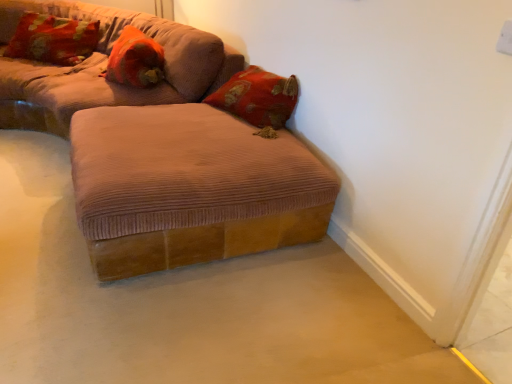
Measure the distance between corduroy brown ottoman at center, which is counted as the second studio couch, starting from the bottom, and camera.

corduroy brown ottoman at center, which is counted as the second studio couch, starting from the bottom, is 2.44 meters away from camera.

Image resolution: width=512 pixels, height=384 pixels. What do you see at coordinates (104, 66) in the screenshot?
I see `corduroy brown ottoman at center, which is counted as the second studio couch, starting from the bottom` at bounding box center [104, 66].

The width and height of the screenshot is (512, 384). What do you see at coordinates (53, 39) in the screenshot? I see `velvet floral pillow at upper left, which is the 1th pillow in left-to-right order` at bounding box center [53, 39].

How much space does orange corduroy pillow at upper left, arranged as the second pillow when viewed from the left, occupy vertically?

orange corduroy pillow at upper left, arranged as the second pillow when viewed from the left, is 31.19 centimeters in height.

Locate an element on the screen. corduroy brown ottoman at lower center, which is the first studio couch in bottom-to-top order is located at coordinates (164, 152).

How different are the orientations of corduroy brown ottoman at center, which is counted as the second studio couch, starting from the bottom, and corduroy brown ottoman at lower center, which is the first studio couch in bottom-to-top order, in degrees?

The angular difference between corduroy brown ottoman at center, which is counted as the second studio couch, starting from the bottom, and corduroy brown ottoman at lower center, which is the first studio couch in bottom-to-top order, is 93.6 degrees.

Is corduroy brown ottoman at center, marked as the 1th studio couch in a top-to-bottom arrangement, inside the boundaries of corduroy brown ottoman at lower center, positioned as the second studio couch in top-to-bottom order, or outside?

corduroy brown ottoman at center, marked as the 1th studio couch in a top-to-bottom arrangement, is not enclosed by corduroy brown ottoman at lower center, positioned as the second studio couch in top-to-bottom order.

I want to click on studio couch on the right of corduroy brown ottoman at center, marked as the 1th studio couch in a top-to-bottom arrangement, so click(164, 152).

Which object is positioned more to the right, corduroy brown ottoman at center, marked as the 1th studio couch in a top-to-bottom arrangement, or corduroy brown ottoman at lower center, positioned as the second studio couch in top-to-bottom order?

corduroy brown ottoman at lower center, positioned as the second studio couch in top-to-bottom order.

Is point (136, 50) more distant than point (80, 54)?

No, it is not.

From the image's perspective, between orange corduroy pillow at upper left, arranged as the second pillow when viewed from the left, and velvet floral pillow at upper left, which is the 1th pillow in left-to-right order, which one is located above?

From the image's view, velvet floral pillow at upper left, which is the 1th pillow in left-to-right order, is above.

Is orange corduroy pillow at upper left, marked as the 1th pillow in a right-to-left arrangement, oriented away from velvet floral pillow at upper left, which is the 1th pillow in left-to-right order?

No.

What's the angular difference between brown corduroy ottoman at center and corduroy brown ottoman at lower center, which is the first studio couch in bottom-to-top order,'s facing directions?

The facing directions of brown corduroy ottoman at center and corduroy brown ottoman at lower center, which is the first studio couch in bottom-to-top order, are 176 degrees apart.

Considering the relative positions of brown corduroy ottoman at center and corduroy brown ottoman at lower center, which is the first studio couch in bottom-to-top order, in the image provided, is brown corduroy ottoman at center behind corduroy brown ottoman at lower center, which is the first studio couch in bottom-to-top order,?

No, brown corduroy ottoman at center is in front of corduroy brown ottoman at lower center, which is the first studio couch in bottom-to-top order.

Is brown corduroy ottoman at center facing away from corduroy brown ottoman at lower center, positioned as the second studio couch in top-to-bottom order?

No, brown corduroy ottoman at center's orientation is not away from corduroy brown ottoman at lower center, positioned as the second studio couch in top-to-bottom order.

From the image's perspective, is brown corduroy ottoman at center over corduroy brown ottoman at lower center, which is the first studio couch in bottom-to-top order?

No.

Between corduroy brown ottoman at center, marked as the 1th studio couch in a top-to-bottom arrangement, and velvet floral pillow at upper left, which is the 1th pillow in left-to-right order, which one appears on the right side from the viewer's perspective?

From the viewer's perspective, corduroy brown ottoman at center, marked as the 1th studio couch in a top-to-bottom arrangement, appears more on the right side.

Which is correct: corduroy brown ottoman at center, marked as the 1th studio couch in a top-to-bottom arrangement, is inside velvet floral pillow at upper left, positioned as the 2th pillow in right-to-left order, or outside of it?

corduroy brown ottoman at center, marked as the 1th studio couch in a top-to-bottom arrangement, cannot be found inside velvet floral pillow at upper left, positioned as the 2th pillow in right-to-left order.

Is corduroy brown ottoman at center, which is counted as the second studio couch, starting from the bottom, positioned with its back to velvet floral pillow at upper left, positioned as the 2th pillow in right-to-left order?

That's right, corduroy brown ottoman at center, which is counted as the second studio couch, starting from the bottom, is facing away from velvet floral pillow at upper left, positioned as the 2th pillow in right-to-left order.

Which is in front, corduroy brown ottoman at center, marked as the 1th studio couch in a top-to-bottom arrangement, or velvet floral pillow at upper left, positioned as the 2th pillow in right-to-left order?

corduroy brown ottoman at center, marked as the 1th studio couch in a top-to-bottom arrangement, is more forward.

Which of these two, corduroy brown ottoman at lower center, which is the first studio couch in bottom-to-top order, or orange corduroy pillow at upper left, arranged as the second pillow when viewed from the left, is bigger?

corduroy brown ottoman at lower center, which is the first studio couch in bottom-to-top order, is bigger.

In the scene shown: Which object is further away from the camera, corduroy brown ottoman at lower center, which is the first studio couch in bottom-to-top order, or orange corduroy pillow at upper left, marked as the 1th pillow in a right-to-left arrangement?

Positioned behind is orange corduroy pillow at upper left, marked as the 1th pillow in a right-to-left arrangement.

Are corduroy brown ottoman at lower center, positioned as the second studio couch in top-to-bottom order, and orange corduroy pillow at upper left, arranged as the second pillow when viewed from the left, far apart?

That's not correct — corduroy brown ottoman at lower center, positioned as the second studio couch in top-to-bottom order, is a little close to orange corduroy pillow at upper left, arranged as the second pillow when viewed from the left.

Which studio couch is the 2nd one when counting from the front of the orange corduroy pillow at upper left, arranged as the second pillow when viewed from the left? Please provide its 2D coordinates.

[(164, 152)]

Is orange corduroy pillow at upper left, arranged as the second pillow when viewed from the left, to the right of brown corduroy ottoman at center from the viewer's perspective?

Result: In fact, orange corduroy pillow at upper left, arranged as the second pillow when viewed from the left, is to the left of brown corduroy ottoman at center.

Would you say orange corduroy pillow at upper left, marked as the 1th pillow in a right-to-left arrangement, is inside or outside brown corduroy ottoman at center?

The correct answer is: outside.

Between point (116, 48) and point (27, 343), which one is positioned in front?

The point (27, 343) is in front.

Are orange corduroy pillow at upper left, marked as the 1th pillow in a right-to-left arrangement, and brown corduroy ottoman at center located far from each other?

Indeed, orange corduroy pillow at upper left, marked as the 1th pillow in a right-to-left arrangement, is not near brown corduroy ottoman at center.

Would you say corduroy brown ottoman at center, marked as the 1th studio couch in a top-to-bottom arrangement, is part of corduroy brown ottoman at lower center, positioned as the second studio couch in top-to-bottom order,'s contents?

Definitely not — corduroy brown ottoman at center, marked as the 1th studio couch in a top-to-bottom arrangement, is not inside corduroy brown ottoman at lower center, positioned as the second studio couch in top-to-bottom order.

Is the position of corduroy brown ottoman at lower center, positioned as the second studio couch in top-to-bottom order, less distant than that of corduroy brown ottoman at center, which is counted as the second studio couch, starting from the bottom?

That is True.

Considering the positions of points (219, 42) and (183, 45), is point (219, 42) closer to camera compared to point (183, 45)?

Yes, point (219, 42) is in front of point (183, 45).

Could you measure the distance between corduroy brown ottoman at lower center, positioned as the second studio couch in top-to-bottom order, and corduroy brown ottoman at center, which is counted as the second studio couch, starting from the bottom?

corduroy brown ottoman at lower center, positioned as the second studio couch in top-to-bottom order, and corduroy brown ottoman at center, which is counted as the second studio couch, starting from the bottom, are 84.82 centimeters apart.

This screenshot has width=512, height=384. Identify the location of studio couch located behind the corduroy brown ottoman at lower center, positioned as the second studio couch in top-to-bottom order. (104, 66).

What are the coordinates of `pillow on the left side of orange corduroy pillow at upper left, arranged as the second pillow when viewed from the left` in the screenshot? It's located at pyautogui.click(x=53, y=39).

From the image, which object appears to be nearer to velvet floral pillow at upper left, positioned as the 2th pillow in right-to-left order, orange corduroy pillow at upper left, arranged as the second pillow when viewed from the left, or corduroy brown ottoman at lower center, positioned as the second studio couch in top-to-bottom order?

orange corduroy pillow at upper left, arranged as the second pillow when viewed from the left, is positioned closer to the anchor velvet floral pillow at upper left, positioned as the 2th pillow in right-to-left order.

Estimate the real-world distances between objects in this image. Which object is closer to orange corduroy pillow at upper left, marked as the 1th pillow in a right-to-left arrangement, brown corduroy ottoman at center or velvet floral pillow at upper left, positioned as the 2th pillow in right-to-left order?

Among the two, velvet floral pillow at upper left, positioned as the 2th pillow in right-to-left order, is located nearer to orange corduroy pillow at upper left, marked as the 1th pillow in a right-to-left arrangement.

When comparing their distances from corduroy brown ottoman at lower center, which is the first studio couch in bottom-to-top order, does orange corduroy pillow at upper left, arranged as the second pillow when viewed from the left, or brown corduroy ottoman at center seem further?

orange corduroy pillow at upper left, arranged as the second pillow when viewed from the left, lies further to corduroy brown ottoman at lower center, which is the first studio couch in bottom-to-top order, than the other object.

When comparing their distances from corduroy brown ottoman at lower center, positioned as the second studio couch in top-to-bottom order, does brown corduroy ottoman at center or corduroy brown ottoman at center, which is counted as the second studio couch, starting from the bottom, seem further?

corduroy brown ottoman at center, which is counted as the second studio couch, starting from the bottom, is further to corduroy brown ottoman at lower center, positioned as the second studio couch in top-to-bottom order.

Which object lies further to the anchor point velvet floral pillow at upper left, which is the 1th pillow in left-to-right order, brown corduroy ottoman at center or corduroy brown ottoman at lower center, which is the first studio couch in bottom-to-top order?

brown corduroy ottoman at center.

From the image, which object appears to be nearer to orange corduroy pillow at upper left, arranged as the second pillow when viewed from the left, corduroy brown ottoman at center, marked as the 1th studio couch in a top-to-bottom arrangement, or velvet floral pillow at upper left, positioned as the 2th pillow in right-to-left order?

corduroy brown ottoman at center, marked as the 1th studio couch in a top-to-bottom arrangement, is closer to orange corduroy pillow at upper left, arranged as the second pillow when viewed from the left.

From the image, which object appears to be farther from corduroy brown ottoman at lower center, which is the first studio couch in bottom-to-top order, corduroy brown ottoman at center, marked as the 1th studio couch in a top-to-bottom arrangement, or brown corduroy ottoman at center?

corduroy brown ottoman at center, marked as the 1th studio couch in a top-to-bottom arrangement.

Looking at the image, which one is located closer to orange corduroy pillow at upper left, arranged as the second pillow when viewed from the left, corduroy brown ottoman at lower center, which is the first studio couch in bottom-to-top order, or brown corduroy ottoman at center?

corduroy brown ottoman at lower center, which is the first studio couch in bottom-to-top order.

The width and height of the screenshot is (512, 384). What are the coordinates of `pillow between corduroy brown ottoman at center, marked as the 1th studio couch in a top-to-bottom arrangement, and velvet floral pillow at upper left, which is the 1th pillow in left-to-right order, along the z-axis` in the screenshot? It's located at (135, 60).

I want to click on studio couch between corduroy brown ottoman at lower center, positioned as the second studio couch in top-to-bottom order, and velvet floral pillow at upper left, positioned as the 2th pillow in right-to-left order, from front to back, so click(104, 66).

Image resolution: width=512 pixels, height=384 pixels. In order to click on pillow positioned between brown corduroy ottoman at center and velvet floral pillow at upper left, positioned as the 2th pillow in right-to-left order, from near to far in this screenshot , I will do `click(135, 60)`.

The width and height of the screenshot is (512, 384). I want to click on studio couch between corduroy brown ottoman at lower center, which is the first studio couch in bottom-to-top order, and orange corduroy pillow at upper left, marked as the 1th pillow in a right-to-left arrangement, from front to back, so click(104, 66).